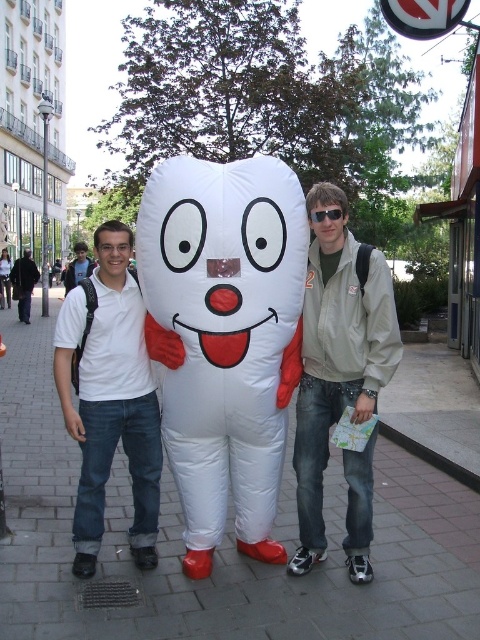
Is white brick pavement at center taller than white matte/inflatable at center?

In fact, white brick pavement at center may be shorter than white matte/inflatable at center.

Who is more distant from viewer, (396,570) or (271,173)?

Positioned behind is point (396,570).

Locate an element on the screen. This screenshot has height=640, width=480. white brick pavement at center is located at coordinates click(x=219, y=547).

Between matte gray jacket at center and white matte shirt at center, which one has less height?

With less height is matte gray jacket at center.

How far apart are matte gray jacket at center and white matte shirt at center?

matte gray jacket at center and white matte shirt at center are 10.85 meters apart.

Which is behind, point (349, 499) or point (80, 260)?

Positioned behind is point (80, 260).

This screenshot has width=480, height=640. I want to click on matte gray jacket at center, so click(336, 353).

Who is positioned more to the left, white brick pavement at center or white matte shirt at left?

Positioned to the left is white brick pavement at center.

Does white brick pavement at center appear under white matte shirt at left?

Yes.

Which is in front, point (285, 481) or point (99, 387)?

Point (99, 387) is more forward.

At what (x,y) coordinates should I click in order to perform the action: click on white brick pavement at center. Please return your answer as a coordinate pair (x, y). This screenshot has height=640, width=480. Looking at the image, I should click on (219, 547).